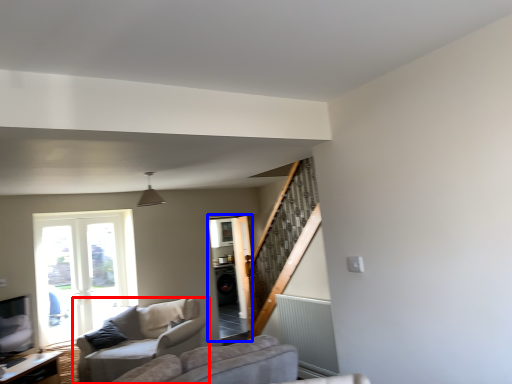
Question: Which of the following is the farthest to the observer, studio couch (highlighted by a red box) or screen door (highlighted by a blue box)?

Choices:
 (A) studio couch
 (B) screen door

Answer: (B)